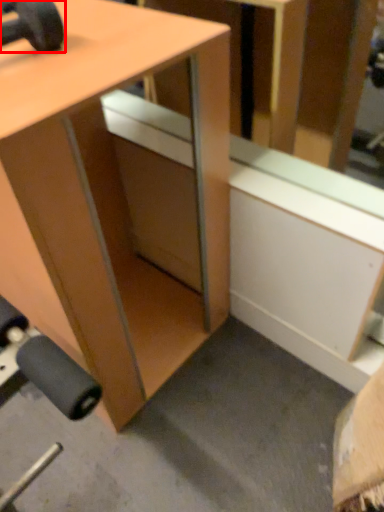
Question: Observing the image, what is the correct spatial positioning of dumbbell (annotated by the red box) in reference to desk?

Choices:
 (A) right
 (B) left

Answer: (B)